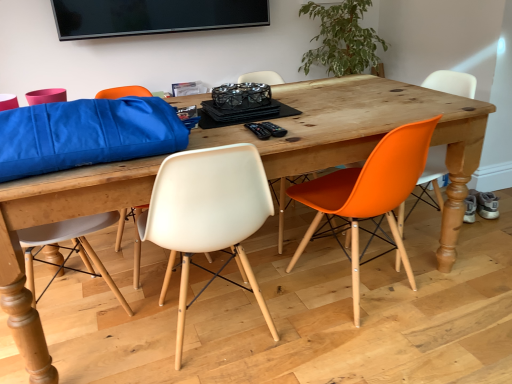
This screenshot has height=384, width=512. I want to click on free location to the right of black plastic remote control at center, which is the second remote control from left to right, so click(x=313, y=127).